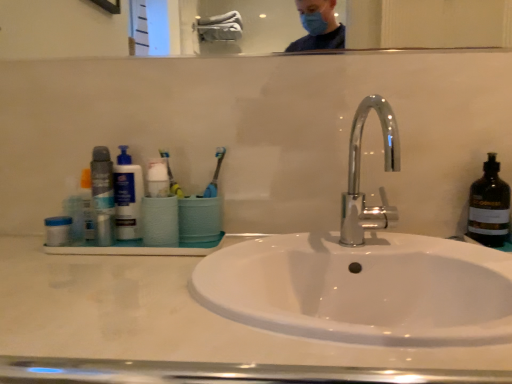
Find the location of a particular element. The width and height of the screenshot is (512, 384). free space to the right of blue plastic container at left is located at coordinates (132, 251).